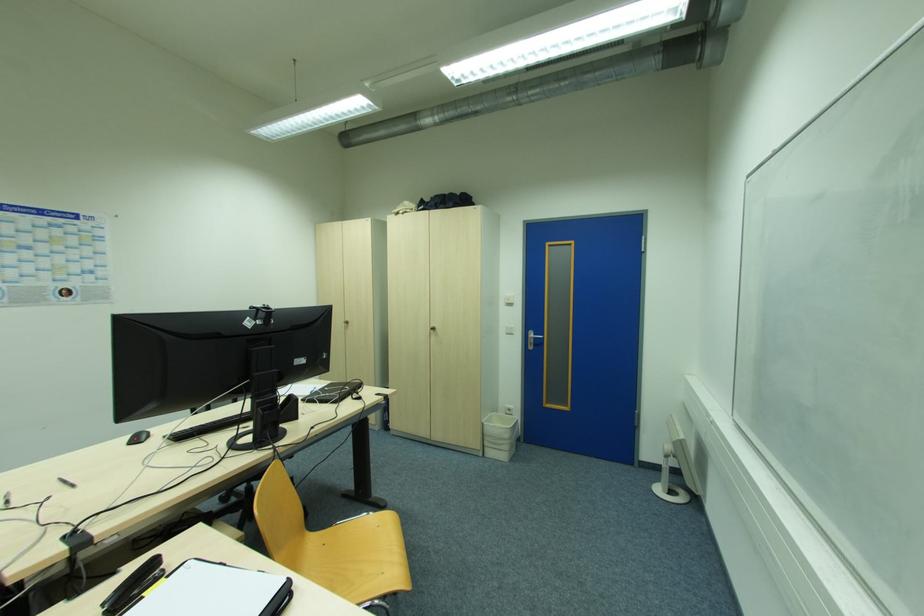
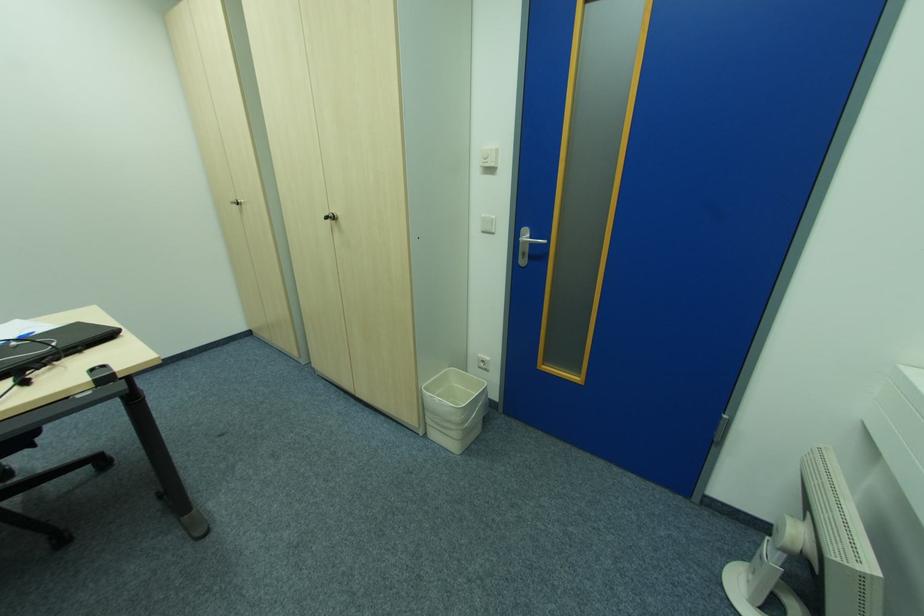
Where in the second image is the point corresponding to the point at 484,424 from the first image?

(424, 391)